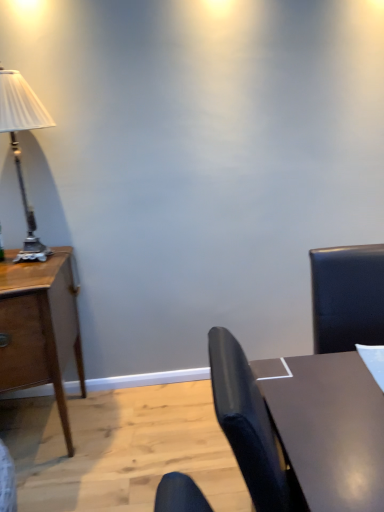
Question: Considering the relative positions of wooden desk at left and silver metallic lamp at left in the image provided, is wooden desk at left to the right of silver metallic lamp at left from the viewer's perspective?

Choices:
 (A) no
 (B) yes

Answer: (A)

Question: Can you confirm if wooden desk at left is thinner than silver metallic lamp at left?

Choices:
 (A) no
 (B) yes

Answer: (A)

Question: From the image's perspective, is wooden desk at left under silver metallic lamp at left?

Choices:
 (A) no
 (B) yes

Answer: (B)

Question: Is wooden desk at left wider than silver metallic lamp at left?

Choices:
 (A) yes
 (B) no

Answer: (A)

Question: Is wooden desk at left directly adjacent to silver metallic lamp at left?

Choices:
 (A) yes
 (B) no

Answer: (B)

Question: Visually, is shiny brown table at lower right positioned to the left or to the right of wooden desk at left?

Choices:
 (A) right
 (B) left

Answer: (A)

Question: Is shiny brown table at lower right in front of or behind wooden desk at left in the image?

Choices:
 (A) front
 (B) behind

Answer: (A)

Question: From the image's perspective, is shiny brown table at lower right above or below wooden desk at left?

Choices:
 (A) below
 (B) above

Answer: (A)

Question: Looking at the image, does shiny brown table at lower right seem bigger or smaller compared to wooden desk at left?

Choices:
 (A) small
 (B) big

Answer: (A)

Question: Is shiny brown table at lower right to the left or to the right of silver metallic lamp at left in the image?

Choices:
 (A) left
 (B) right

Answer: (B)

Question: Do you think shiny brown table at lower right is within silver metallic lamp at left, or outside of it?

Choices:
 (A) outside
 (B) inside

Answer: (A)

Question: From the image's perspective, is shiny brown table at lower right located above or below silver metallic lamp at left?

Choices:
 (A) above
 (B) below

Answer: (B)

Question: Considering the positions of shiny brown table at lower right and silver metallic lamp at left in the image, is shiny brown table at lower right bigger or smaller than silver metallic lamp at left?

Choices:
 (A) small
 (B) big

Answer: (B)

Question: In terms of height, does wooden desk at left look taller or shorter compared to silver metallic lamp at left?

Choices:
 (A) short
 (B) tall

Answer: (B)

Question: Is wooden desk at left spatially inside silver metallic lamp at left, or outside of it?

Choices:
 (A) outside
 (B) inside

Answer: (A)